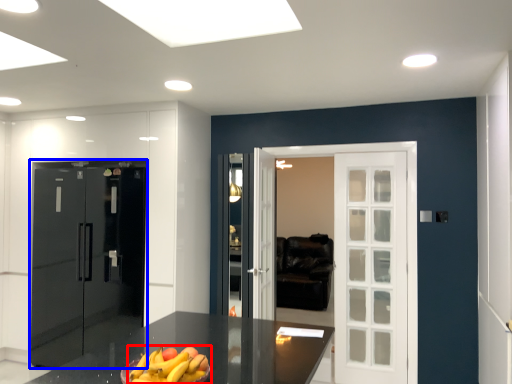
Question: Which point is further to the camera, banana (highlighted by a red box) or door (highlighted by a blue box)?

Choices:
 (A) banana
 (B) door

Answer: (B)